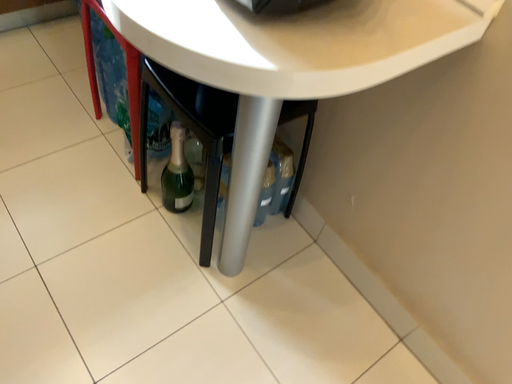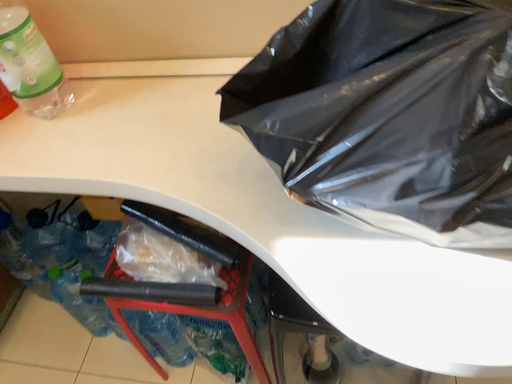
Question: How did the camera likely rotate when shooting the video?

Choices:
 (A) rotated upward
 (B) rotated downward

Answer: (A)